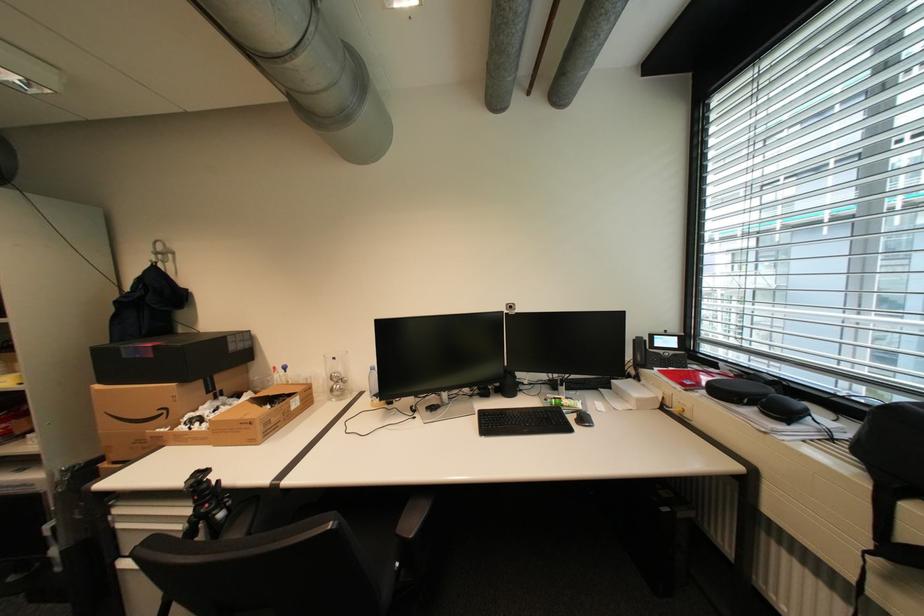
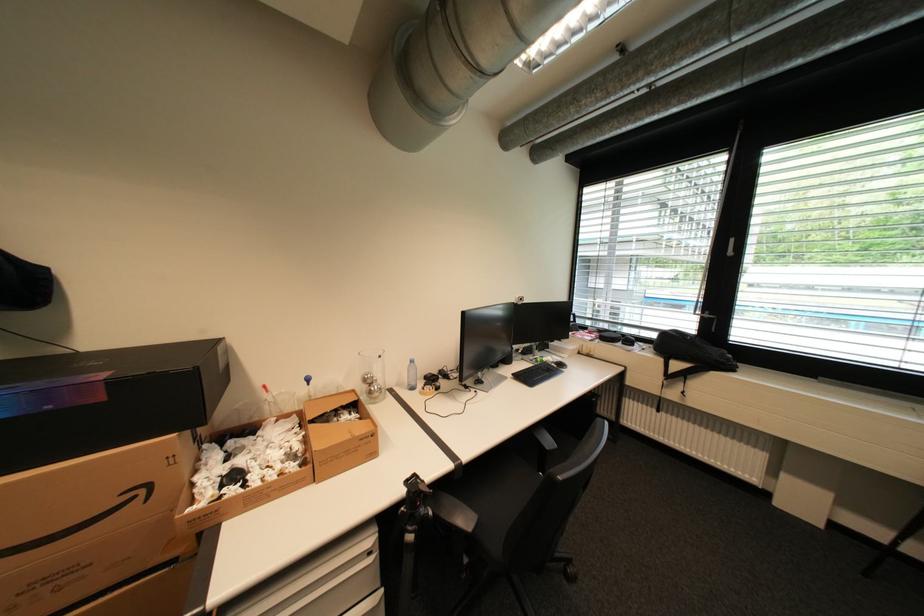
Locate, in the second image, the point that corresponds to [174,411] in the first image.

(151, 491)